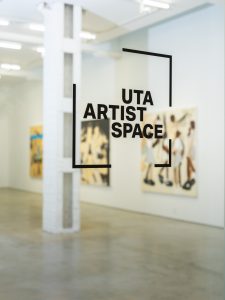
The height and width of the screenshot is (300, 225). Identify the location of glass door. (206, 60).